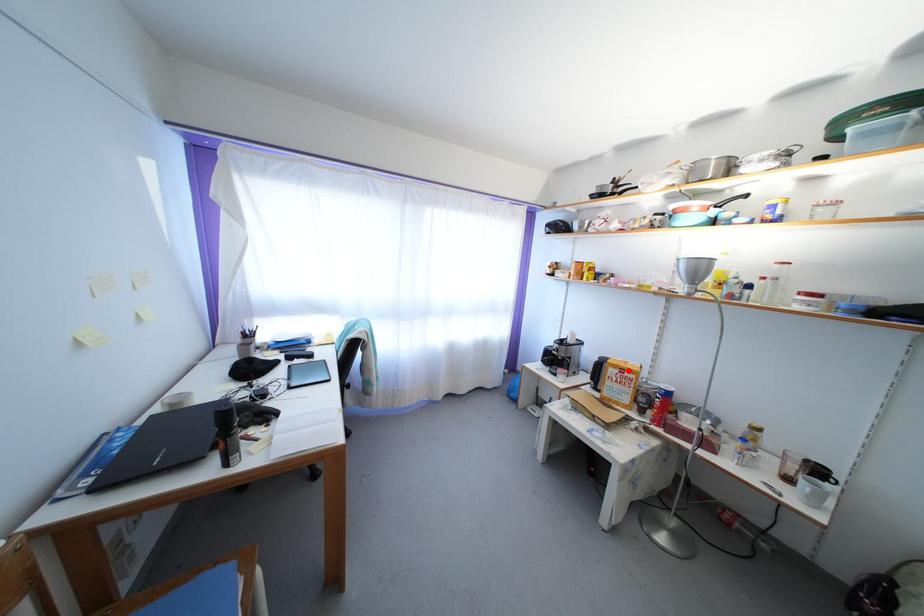
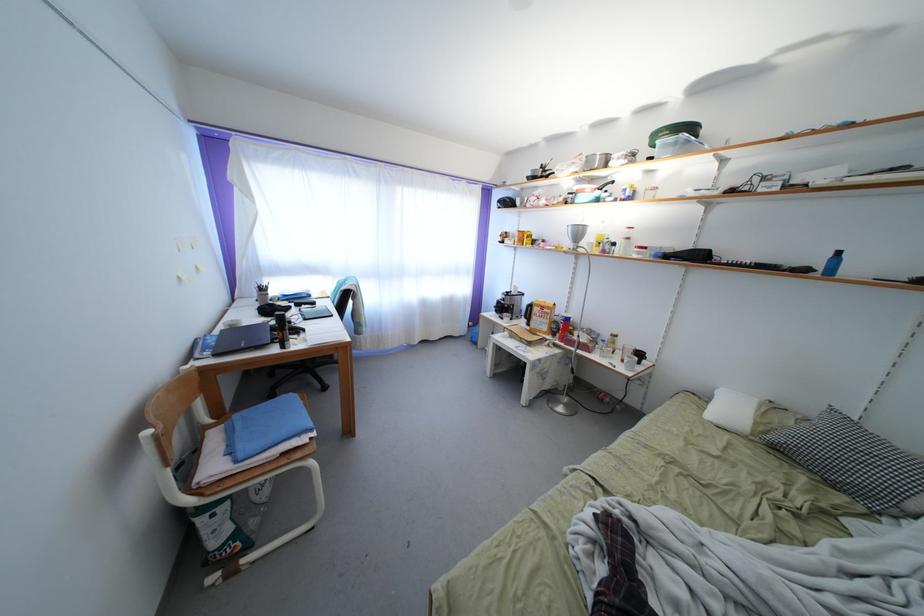
Locate, in the second image, the point that corresponds to the highlighted location in the first image.

(549, 310)